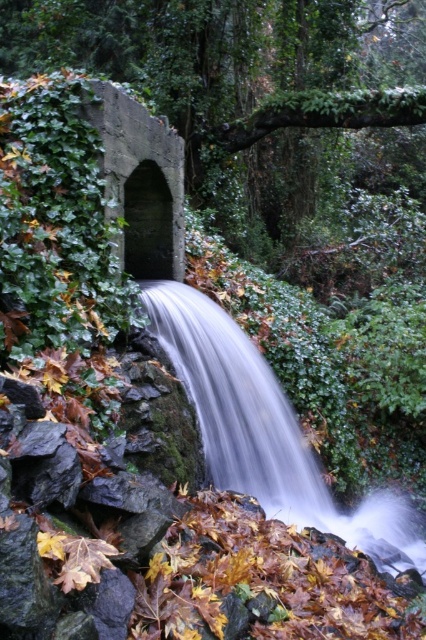
Question: Which point is farther from the camera taking this photo?

Choices:
 (A) (414, 564)
 (B) (195, 92)

Answer: (B)

Question: Observing the image, what is the correct spatial positioning of green ivy-covered stone arch at center in reference to white smooth waterfall at center?

Choices:
 (A) above
 (B) below

Answer: (A)

Question: Does green ivy-covered stone arch at center appear on the right side of white smooth waterfall at center?

Choices:
 (A) yes
 (B) no

Answer: (A)

Question: Observing the image, what is the correct spatial positioning of green ivy-covered stone arch at center in reference to white smooth waterfall at center?

Choices:
 (A) right
 (B) left

Answer: (A)

Question: Among these objects, which one is farthest from the camera?

Choices:
 (A) green ivy-covered stone arch at center
 (B) white smooth waterfall at center

Answer: (A)